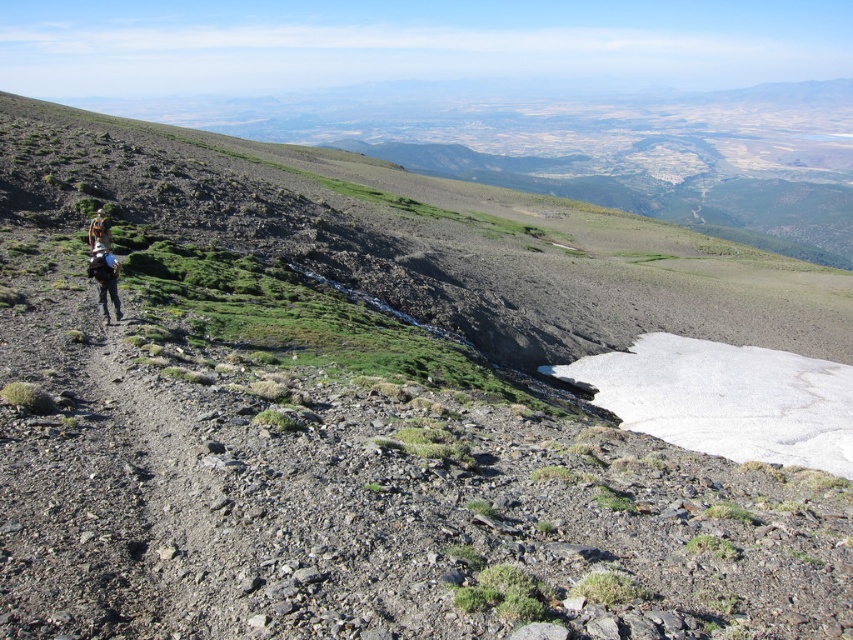
You are a photographer planning to capture the rugged mountain landscape. You want to ensure the dull gray gravel at center and the matte black backpack at lower left are both visible in your shot. Given their sizes, which object will appear larger in the photo?

The dull gray gravel at center will appear larger in the photo because it is bigger than the matte black backpack at lower left.

You are a photographer standing at the camera position. You want to take a closeup shot of the matte black backpack at lower left. What is the minimum distance you need to move towards the backpack to get it into focus, assuming your camera can focus on objects as close as 2 meters?

The matte black backpack at lower left is 21.12 meters away from the camera. To get it into focus, you need to move close enough so that the distance is within 2 meters. Therefore, you must move 21.12 meters minus 2 meters, which equals 19.12 meters towards the backpack.

You are a hiker trying to navigate the path. The dull gray gravel at center and the matte black backpack at lower left are in your view. Which object is positioned to the right of the other?

The dull gray gravel at center is to the right of the matte black backpack at lower left.